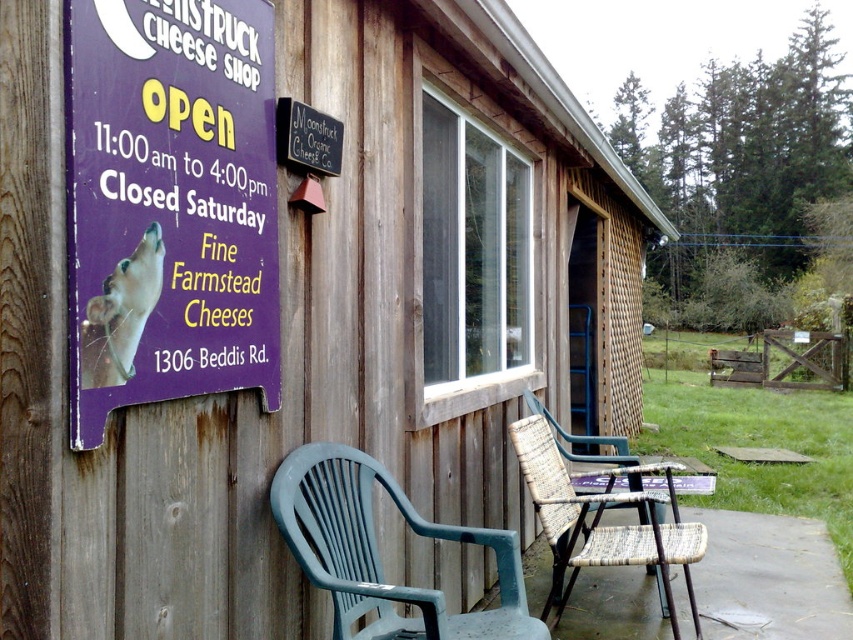
Question: In this image, where is woven brown chair at lower center located relative to white fur dog at left?

Choices:
 (A) above
 (B) below

Answer: (B)

Question: Which object is farther from the camera taking this photo?

Choices:
 (A) green plastic chair at lower center
 (B) purple wood sign at left

Answer: (A)

Question: Which point appears closest to the camera in this image?

Choices:
 (A) (682, 557)
 (B) (444, 628)

Answer: (B)

Question: Is the position of purple wood sign at left less distant than that of green plastic chair at lower center?

Choices:
 (A) no
 (B) yes

Answer: (B)

Question: Can you confirm if purple wood sign at left is positioned above white fur dog at left?

Choices:
 (A) no
 (B) yes

Answer: (B)

Question: Which object appears closest to the camera in this image?

Choices:
 (A) white fur dog at left
 (B) woven brown chair at lower center
 (C) green plastic chair at lower center
 (D) purple wood sign at left

Answer: (D)